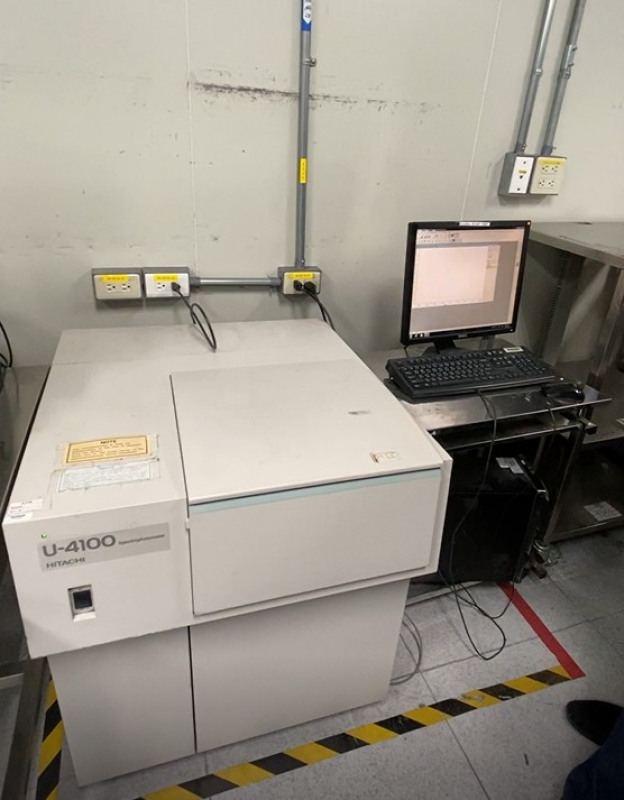
Find the location of a particular element. This screenshot has height=800, width=624. electrical outlets is located at coordinates (113, 292), (124, 288), (157, 289), (537, 169), (557, 166), (539, 186), (553, 186).